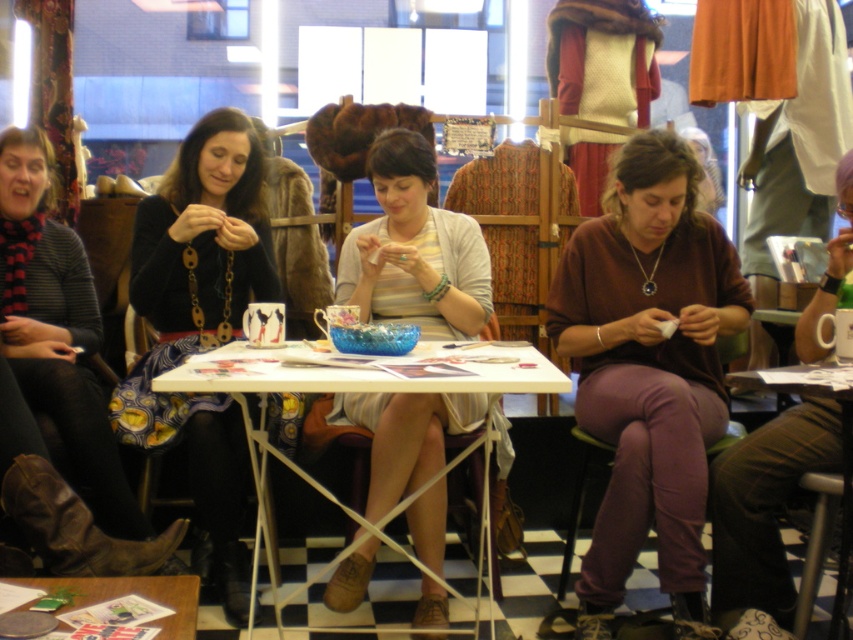
You are a visitor in the crafting workshop and want to take a photo of the black knit sweater at left without moving any objects. Where should you position yourself to capture the sweater in the frame?

To capture the black knit sweater at left in the frame, position yourself at the same level as the sweater, ensuring it is centered within your camera viewfinder. Since the sweater is located at coordinates point (59,332), align your camera accordingly for the best shot.

You are standing in the room and want to reach the black knit sweater at left. The room has a door 6 feet away from you. Can you reach the sweater before exiting the room?

The black knit sweater at left is 5.91 feet away from you, which is closer than the door that is 6 feet away. Therefore, you can reach the sweater before exiting the room.

You are organizing a clothing display and need to stack the matte black sweater at center and the striped cotton shirt at center vertically. Which one should you place at the bottom to ensure stability?

The matte black sweater at center should be placed at the bottom because it has a greater height than the striped cotton shirt at center, providing a more stable base.